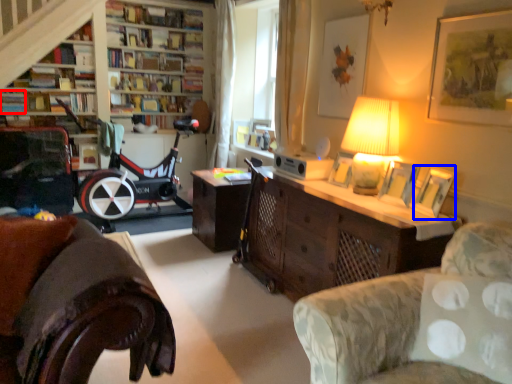
Question: Among these objects, which one is farthest to the camera, book (highlighted by a red box) or picture frame (highlighted by a blue box)?

Choices:
 (A) book
 (B) picture frame

Answer: (A)